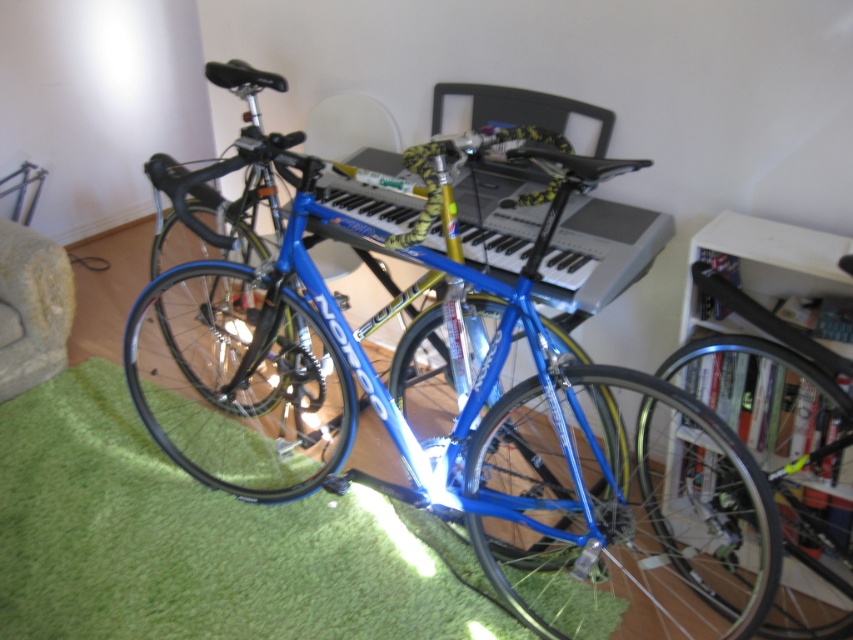
You are standing in the room and want to place a new speaker system. The speaker system requires a space that is 1 meter away from the blue metallic bicycle at center. Based on the coordinates provided in the Objects Description, can you determine if the current setup allows placing the speaker system at point 0.634, 0.537?

The blue metallic bicycle at center is located at point [457,404]. Placing the speaker system at the same coordinates would mean it is directly at the bicycle, not 1 meter away. Therefore, the current setup does not allow placing the speaker system at that point as it violates the required distance.